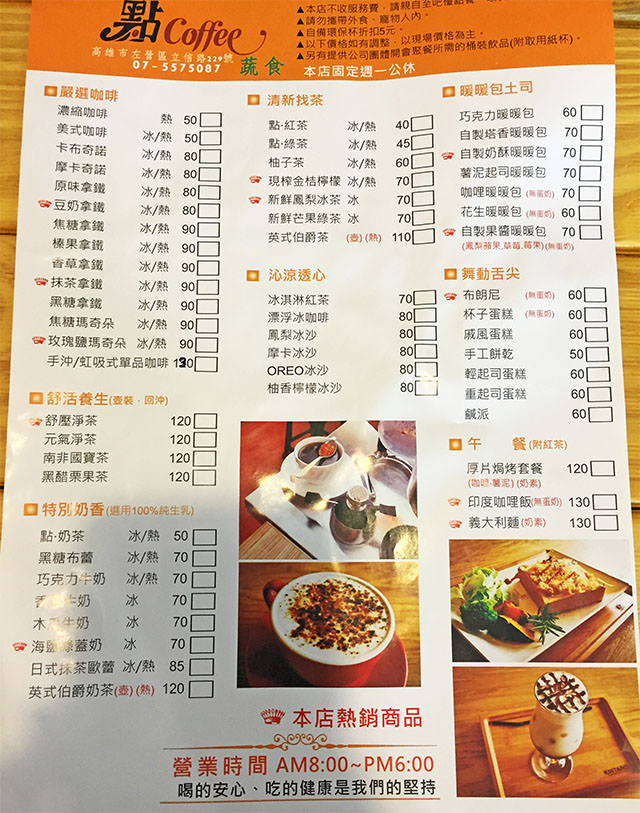
Locate an element on the screen. handle is located at coordinates (272, 585).